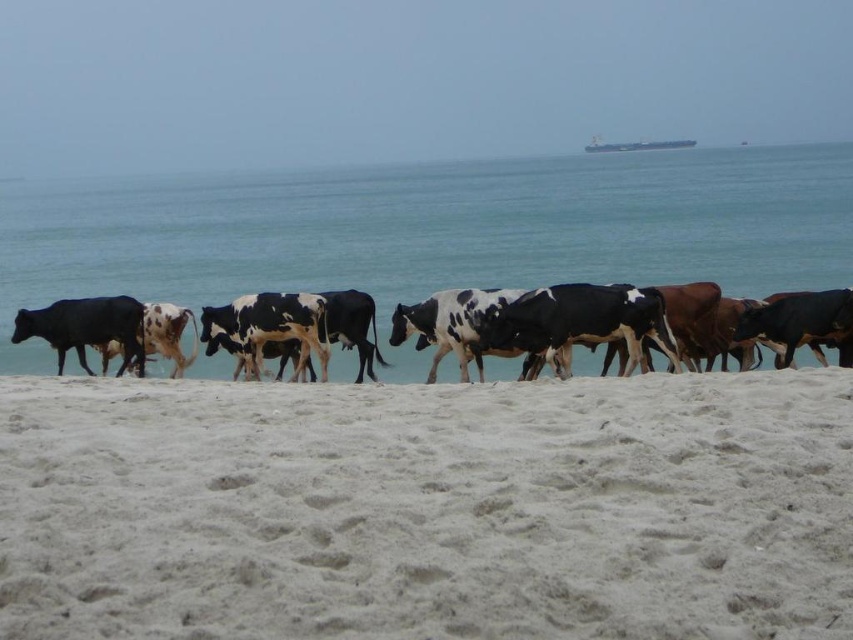
Question: Estimate the real-world distances between objects in this image. Which object is closer to the white sandy beach at lower center?

Choices:
 (A) black and white cow at center
 (B) black glossy cow at left
 (C) blue water at center

Answer: (B)

Question: Does blue water at center appear under black and white cow at center?

Choices:
 (A) no
 (B) yes

Answer: (A)

Question: Among these points, which one is farthest from the camera?

Choices:
 (A) (412, 316)
 (B) (173, 268)
 (C) (612, 513)
 (D) (90, 333)

Answer: (B)

Question: Does white sandy beach at lower center have a greater width compared to blue water at center?

Choices:
 (A) yes
 (B) no

Answer: (B)

Question: Among these points, which one is nearest to the camera?

Choices:
 (A) (202, 488)
 (B) (125, 332)
 (C) (691, 237)
 (D) (33, 348)

Answer: (A)

Question: Is black glossy cow at left bigger than black and white cow at center?

Choices:
 (A) no
 (B) yes

Answer: (A)